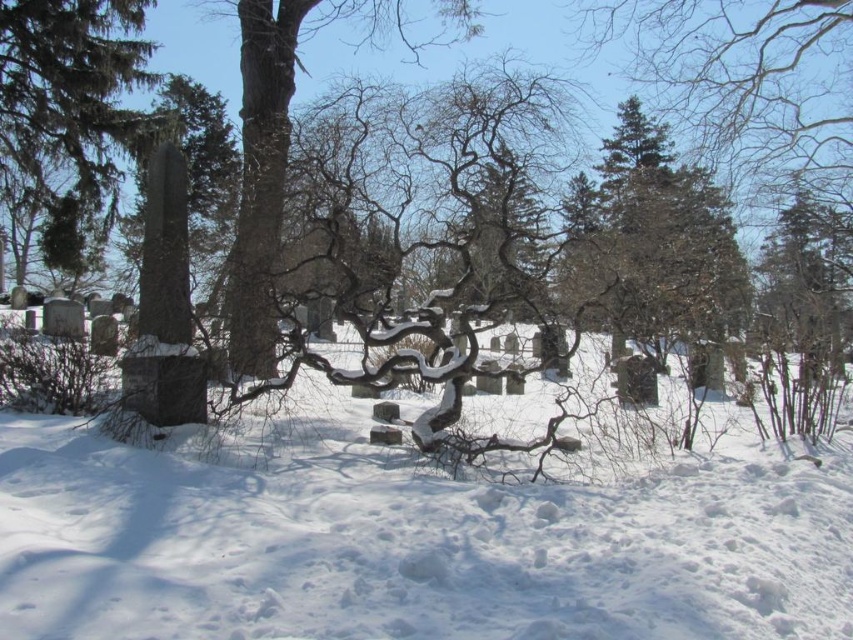
Is white powdery snow at center smaller than smooth gray stone at center?

Correct, white powdery snow at center occupies less space than smooth gray stone at center.

Does white powdery snow at center appear on the right side of smooth gray stone at center?

Incorrect, white powdery snow at center is not on the right side of smooth gray stone at center.

Describe the element at coordinates (408, 540) in the screenshot. I see `white powdery snow at center` at that location.

What are the coordinates of `white powdery snow at center` in the screenshot? It's located at (408, 540).

Is smooth gray stone at left thinner than smooth gray stone at center?

Indeed, smooth gray stone at left has a lesser width compared to smooth gray stone at center.

Describe the element at coordinates (68, 100) in the screenshot. I see `smooth gray stone at left` at that location.

In order to click on smooth gray stone at left in this screenshot , I will do `click(68, 100)`.

Between white powdery snow at center and smooth gray stone at left, which one is positioned lower?

Positioned lower is white powdery snow at center.

Which is more to the left, white powdery snow at center or smooth gray stone at left?

smooth gray stone at left is more to the left.

What do you see at coordinates (408, 540) in the screenshot? The image size is (853, 640). I see `white powdery snow at center` at bounding box center [408, 540].

Locate an element on the screen. The height and width of the screenshot is (640, 853). white powdery snow at center is located at coordinates (408, 540).